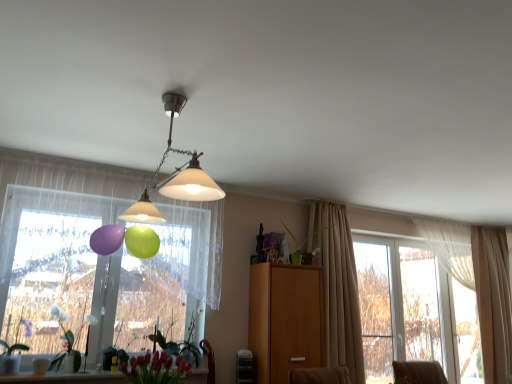
Question: Considering the relative sizes of matte white lampshade at center and green matte plant at lower left, acting as the first plant starting from the left, in the image provided, is matte white lampshade at center taller than green matte plant at lower left, acting as the first plant starting from the left,?

Choices:
 (A) yes
 (B) no

Answer: (A)

Question: Is matte white lampshade at center outside green matte plant at lower left, acting as the first plant starting from the left?

Choices:
 (A) yes
 (B) no

Answer: (A)

Question: Can you confirm if matte white lampshade at center is bigger than green matte plant at lower left, acting as the first plant starting from the left?

Choices:
 (A) yes
 (B) no

Answer: (A)

Question: Considering the relative sizes of matte white lampshade at center and green matte plant at lower left, acting as the first plant starting from the left, in the image provided, is matte white lampshade at center wider than green matte plant at lower left, acting as the first plant starting from the left,?

Choices:
 (A) no
 (B) yes

Answer: (B)

Question: Considering the relative positions of matte white lampshade at center and green matte plant at lower left, acting as the first plant starting from the left, in the image provided, is matte white lampshade at center behind green matte plant at lower left, acting as the first plant starting from the left,?

Choices:
 (A) no
 (B) yes

Answer: (A)

Question: In terms of size, does beige fabric curtain at right, which is counted as the 1th curtain, starting from the left, appear bigger or smaller than transparent glass window at left, which is the 1th window in top-to-bottom order?

Choices:
 (A) small
 (B) big

Answer: (A)

Question: Considering their positions, is beige fabric curtain at right, which is the second curtain in right-to-left order, located in front of or behind transparent glass window at left, marked as the second window in a bottom-to-top arrangement?

Choices:
 (A) front
 (B) behind

Answer: (B)

Question: Is point (346, 276) closer or farther from the camera than point (118, 316)?

Choices:
 (A) farther
 (B) closer

Answer: (A)

Question: From a real-world perspective, is beige fabric curtain at right, which is the second curtain in right-to-left order, positioned above or below transparent glass window at left, marked as the second window in a bottom-to-top arrangement?

Choices:
 (A) above
 (B) below

Answer: (B)

Question: Based on their sizes in the image, would you say transparent glass door at right, which is counted as the 1th window frame, starting from the right, is bigger or smaller than beige fabric curtain at right, which is the second curtain in right-to-left order?

Choices:
 (A) big
 (B) small

Answer: (B)

Question: Looking at their shapes, would you say transparent glass door at right, positioned as the second window frame in left-to-right order, is wider or thinner than beige fabric curtain at right, which is the second curtain in right-to-left order?

Choices:
 (A) wide
 (B) thin

Answer: (B)

Question: Is transparent glass door at right, positioned as the second window frame in left-to-right order, inside or outside of beige fabric curtain at right, acting as the 2th curtain starting from the back?

Choices:
 (A) outside
 (B) inside

Answer: (A)

Question: Is point (407, 288) closer or farther from the camera than point (350, 339)?

Choices:
 (A) farther
 (B) closer

Answer: (A)

Question: Is clear glass window at right, arranged as the second window frame when viewed from the right, situated inside green matte plant at center, acting as the first plant starting from the right, or outside?

Choices:
 (A) inside
 (B) outside

Answer: (B)

Question: From the image's perspective, relative to green matte plant at center, the 4th plant positioned from the left, is clear glass window at right, which is counted as the first window frame, starting from the left, above or below?

Choices:
 (A) below
 (B) above

Answer: (A)